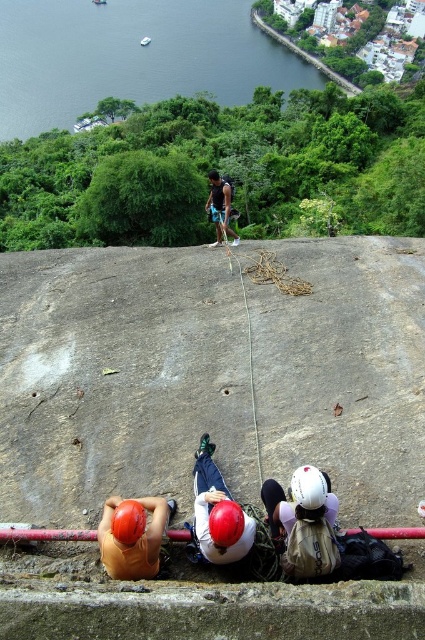
You are a hiker planning to set up a small tent. You see the gray rough concrete at center and the orange matte helmet at lower left. Which surface would be more suitable for placing the tent? Please explain your reasoning based on their sizes.

The gray rough concrete at center is more suitable for placing the tent because it has a larger size compared to the orange matte helmet at lower left, providing enough space for the tent.